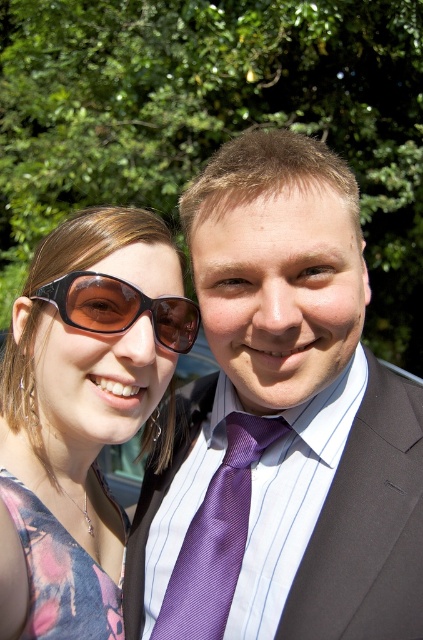
Can you confirm if purple satin business suit at center is positioned above floral fabric dress at lower left?

Correct, purple satin business suit at center is located above floral fabric dress at lower left.

Between purple satin business suit at center and floral fabric dress at lower left, which one appears on the right side from the viewer's perspective?

purple satin business suit at center

Describe the element at coordinates (368, 525) in the screenshot. I see `purple satin business suit at center` at that location.

I want to click on purple satin business suit at center, so click(x=368, y=525).

Is purple silk tie at center positioned in front of floral fabric dress at lower left?

That is True.

Measure the distance between purple silk tie at center and floral fabric dress at lower left.

purple silk tie at center is 9.90 inches from floral fabric dress at lower left.

Which is in front, point (203, 621) or point (41, 525)?

Point (203, 621) is in front.

Find the location of a particular element. This screenshot has height=640, width=423. purple silk tie at center is located at coordinates (216, 536).

The image size is (423, 640). I want to click on matte black sunglasses at left, so click(84, 404).

Between matte black sunglasses at left and purple satin business suit at center, which one has more height?

matte black sunglasses at left

Where is `matte black sunglasses at left`? This screenshot has height=640, width=423. matte black sunglasses at left is located at coordinates (84, 404).

Find the location of a particular element. The width and height of the screenshot is (423, 640). matte black sunglasses at left is located at coordinates (84, 404).